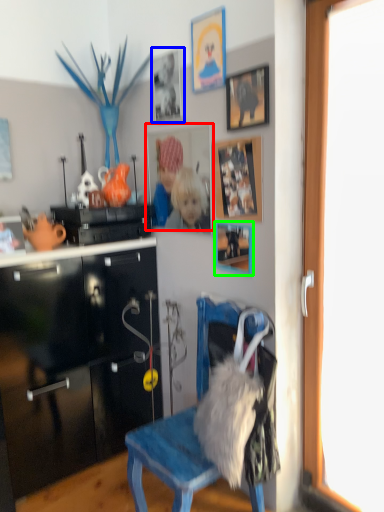
Question: Estimate the real-world distances between objects in this image. Which object is closer to picture frame (highlighted by a red box), picture frame (highlighted by a blue box) or picture frame (highlighted by a green box)?

Choices:
 (A) picture frame
 (B) picture frame

Answer: (A)